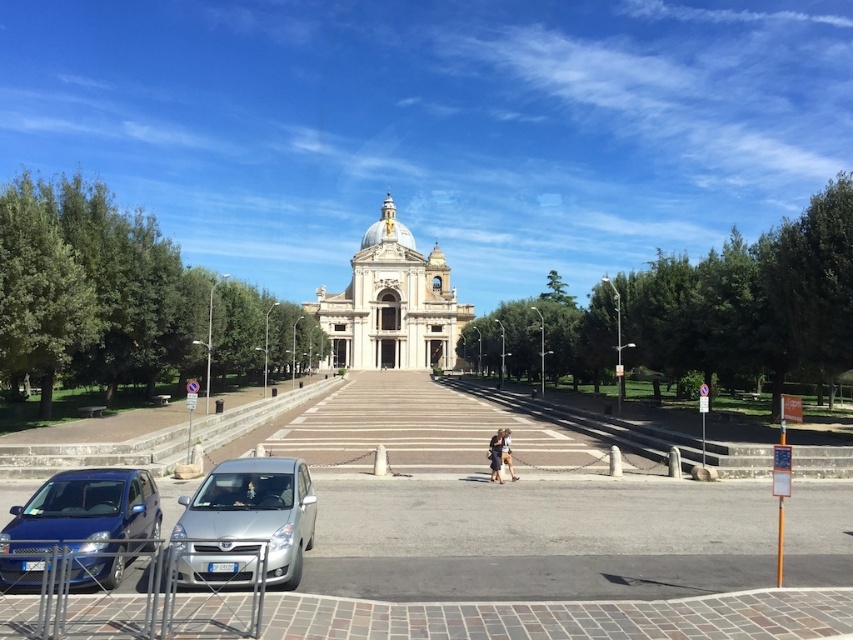
In the scene shown: Who is more distant from viewer, (225, 576) or (134, 538)?

Point (134, 538)

The width and height of the screenshot is (853, 640). What are the coordinates of `silver metallic car at lower left` in the screenshot? It's located at (247, 524).

Can you confirm if white marble church at center is positioned to the left of light brown leather jacket at center?

Indeed, white marble church at center is positioned on the left side of light brown leather jacket at center.

Is white marble church at center positioned before light brown leather jacket at center?

No, it is behind light brown leather jacket at center.

Does point (351, 305) lie behind point (506, 460)?

Yes, point (351, 305) is farther from viewer.

Identify the location of white marble church at center. Image resolution: width=853 pixels, height=640 pixels. (392, 305).

Does metallic blue hatchback at lower left have a lesser height compared to light brown leather jacket at center?

No, metallic blue hatchback at lower left is not shorter than light brown leather jacket at center.

Which is in front, point (120, 561) or point (506, 460)?

Point (120, 561)

Image resolution: width=853 pixels, height=640 pixels. What are the coordinates of `metallic blue hatchback at lower left` in the screenshot? It's located at (80, 525).